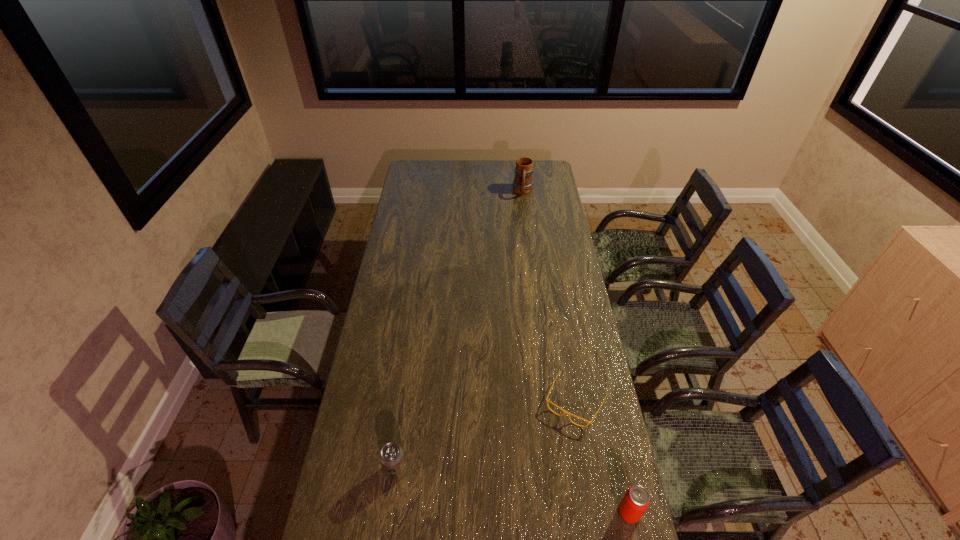
This screenshot has width=960, height=540. What are the coordinates of `vacant space on the desktop that is between the second nearest object and the nearest object and is positioned in front of the lenses of the shortest object` in the screenshot? It's located at (527, 494).

This screenshot has width=960, height=540. Find the location of `vacant space on the desktop that is between the leftmost object and the right beer can and is positioned on the side of the farthest object with the handle`. vacant space on the desktop that is between the leftmost object and the right beer can and is positioned on the side of the farthest object with the handle is located at coordinates (509, 491).